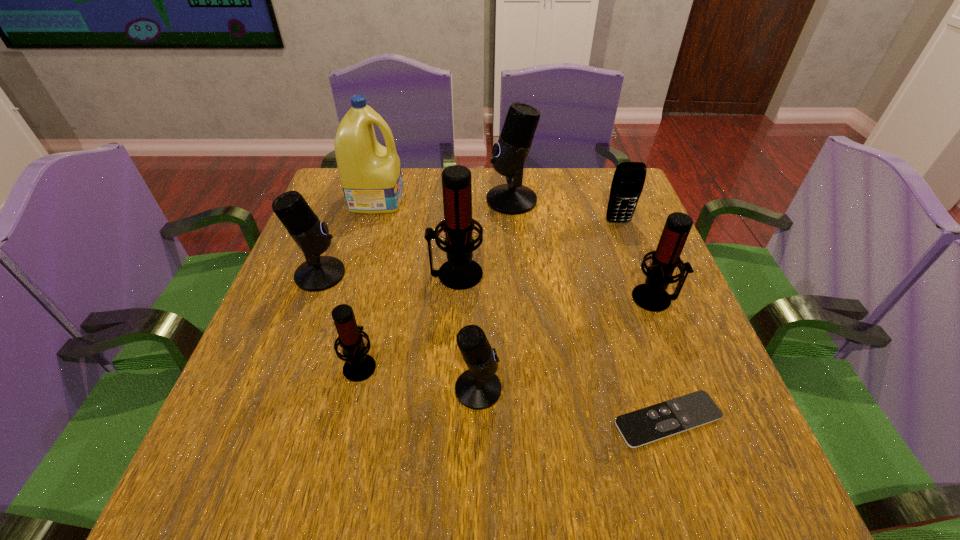
Identify the location of free space that satisfies the following two spatial constraints: 1. on the stand of the farthest microphone; 2. on the back side of the rightmost red microphone. Image resolution: width=960 pixels, height=540 pixels. (520, 298).

This screenshot has height=540, width=960. Identify the location of vacant region that satisfies the following two spatial constraints: 1. on the front side of the rightmost red microphone; 2. on the stand of the nearest black microphone. (690, 389).

Find the location of a particular element. The width and height of the screenshot is (960, 540). free space that satisfies the following two spatial constraints: 1. on the stand of the rightmost microphone; 2. on the right side of the second biggest black microphone is located at coordinates (311, 298).

The height and width of the screenshot is (540, 960). In order to click on free spot that satisfies the following two spatial constraints: 1. on the stand of the farthest microphone; 2. on the left side of the rightmost red microphone in this screenshot , I will do tap(520, 298).

At what (x,y) coordinates should I click in order to perform the action: click on vacant position in the image that satisfies the following two spatial constraints: 1. on the stand of the second smallest black microphone; 2. on the right side of the black remote control. Please return your answer as a coordinate pair (x, y). Looking at the image, I should click on (266, 420).

Where is `free location that satisfies the following two spatial constraints: 1. on the stand of the farthest microphone; 2. on the left side of the remote control`? free location that satisfies the following two spatial constraints: 1. on the stand of the farthest microphone; 2. on the left side of the remote control is located at coordinates (532, 420).